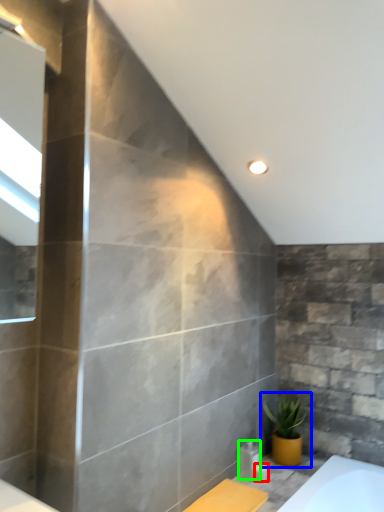
Question: Considering the real-world distances, which object is farthest from toiletry (highlighted by a red box)? houseplant (highlighted by a blue box) or toiletry (highlighted by a green box)?

Choices:
 (A) houseplant
 (B) toiletry

Answer: (A)